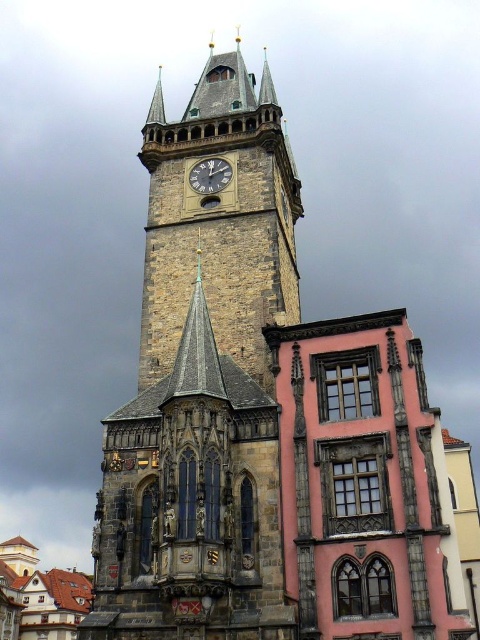
Question: From the image, what is the correct spatial relationship of stone clock tower at center in relation to dark gray stone clock at center?

Choices:
 (A) below
 (B) above

Answer: (B)

Question: Which object appears closest to the camera in this image?

Choices:
 (A) stone clock tower at center
 (B) dark gray stone clock at center

Answer: (A)

Question: Observing the image, what is the correct spatial positioning of stone clock tower at center in reference to dark gray stone clock at center?

Choices:
 (A) left
 (B) right

Answer: (A)

Question: Can you confirm if stone clock tower at center is positioned above dark gray stone clock at center?

Choices:
 (A) no
 (B) yes

Answer: (B)